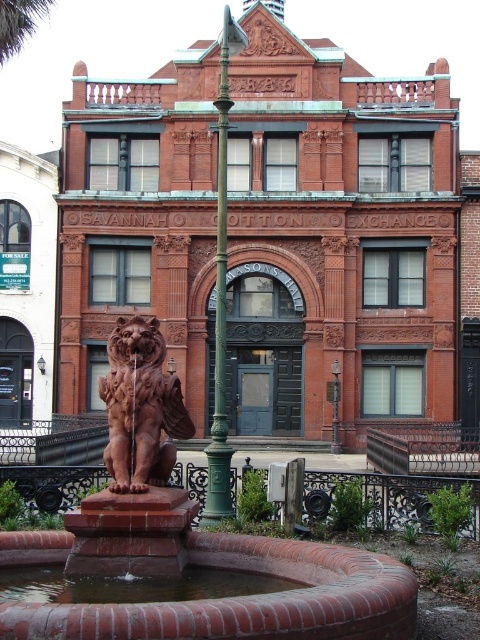
Question: Is green cast iron pole at center to the right of green leafy palm tree at upper left from the viewer's perspective?

Choices:
 (A) yes
 (B) no

Answer: (A)

Question: Can you confirm if matte terracotta lion at center is thinner than green metal pole at center?

Choices:
 (A) no
 (B) yes

Answer: (A)

Question: Which point is closer to the camera?

Choices:
 (A) pos(335,432)
 (B) pos(369,561)
 (C) pos(162,451)

Answer: (B)

Question: Which object appears closest to the camera in this image?

Choices:
 (A) green metal pole at center
 (B) matte terracotta lion at center
 (C) matte brown lion at center

Answer: (B)

Question: Is green cast iron pole at center in front of green metal pole at center?

Choices:
 (A) yes
 (B) no

Answer: (A)

Question: Which point appears closest to the camera in this image?

Choices:
 (A) (189, 634)
 (B) (339, 444)
 (C) (10, 52)

Answer: (A)